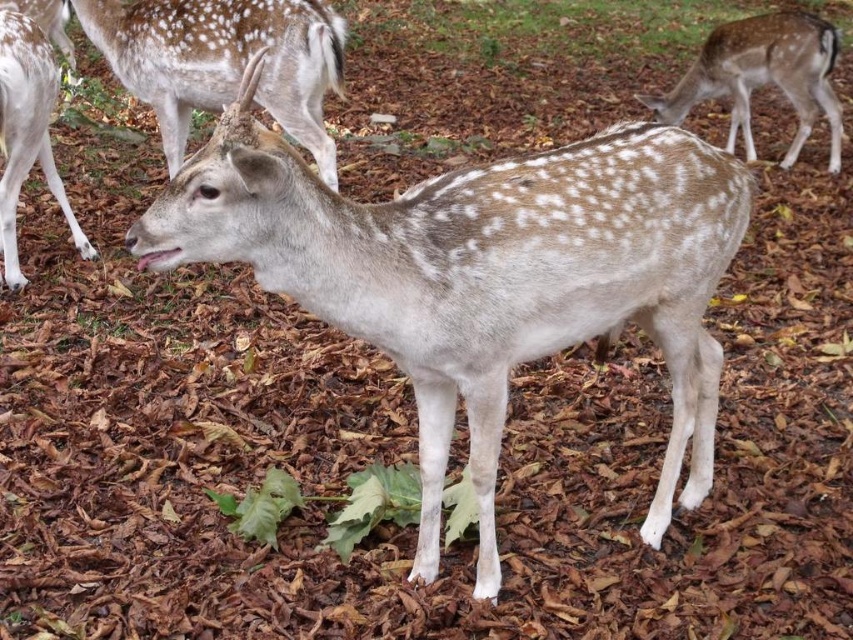
Between point (451, 276) and point (45, 129), which one is positioned behind?

The point (45, 129) is more distant.

Locate an element on the screen. speckled fur deer at center is located at coordinates (480, 276).

In the scene shown: Which is above, speckled fur antlers at upper left or speckled fur deer at upper right?

speckled fur deer at upper right is higher up.

Is speckled fur antlers at upper left closer to the viewer compared to speckled fur deer at upper right?

Yes.

Who is more forward, (115, 36) or (728, 93)?

Point (115, 36)

Find the location of a particular element. speckled fur antlers at upper left is located at coordinates (223, 61).

Locate an element on the screen. This screenshot has width=853, height=640. speckled fur deer at center is located at coordinates (x=480, y=276).

Does speckled fur deer at center appear on the right side of speckled fur antlers at upper left?

Correct, you'll find speckled fur deer at center to the right of speckled fur antlers at upper left.

Is point (699, 280) farther from camera compared to point (289, 129)?

No, (699, 280) is closer to viewer.

Identify the location of speckled fur deer at center. (480, 276).